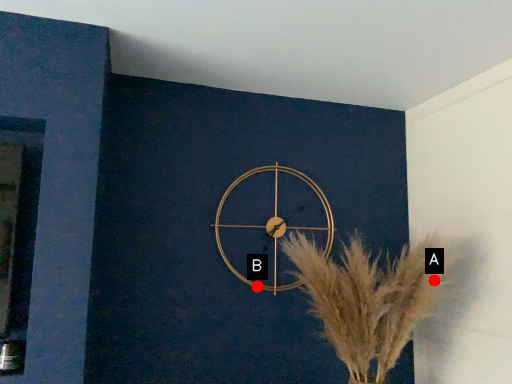
Question: Two points are circled on the image, labeled by A and B beside each circle. Which point is farther from the camera taking this photo?

Choices:
 (A) A is further
 (B) B is further

Answer: (B)